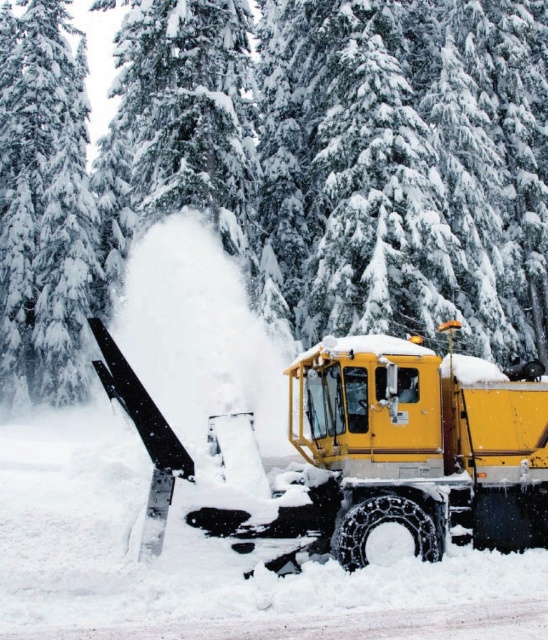
You are standing at the point marked as point (156, 74) and want to walk to the snowplow at the center. The path is straight. If your walking speed is 3 feet per second, how many seconds will it take you to reach the snowplow?

The distance between point (156, 74) and the snowplow at the center is 66.37 feet. At a speed of 3 feet per second, it will take 66.37 divided by 3, which is approximately 22.12 seconds to reach the snowplow.

You are standing at point [68,42] and want to walk to point [146,412]. Is the path between them clear of obstacles?

Point [146,412] is in front of point [68,42], so the path between them is clear of obstacles.